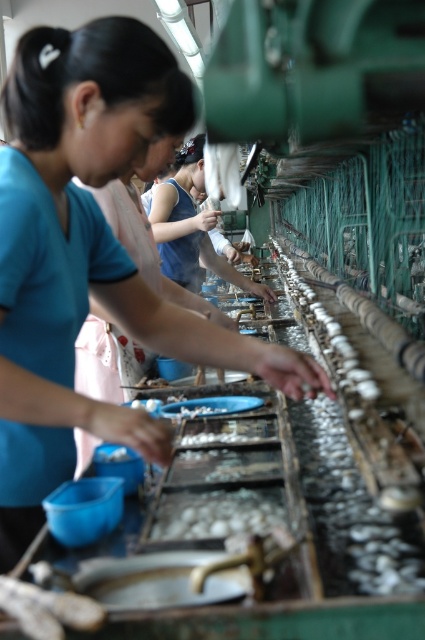
Question: Among these points, which one is nearest to the camera?

Choices:
 (A) (16, 384)
 (B) (193, 497)

Answer: (A)

Question: Does matte blue shirt at center lie behind white glossy oyster at center?

Choices:
 (A) yes
 (B) no

Answer: (B)

Question: Can you confirm if matte blue shirt at center is positioned to the right of white glossy oyster at center?

Choices:
 (A) no
 (B) yes

Answer: (A)

Question: Is matte blue shirt at center above white glossy oyster at center?

Choices:
 (A) no
 (B) yes

Answer: (B)

Question: Which of the following is the closest to the observer?

Choices:
 (A) white glossy oyster at center
 (B) matte blue shirt at center

Answer: (B)

Question: Which object appears closest to the camera in this image?

Choices:
 (A) matte blue shirt at center
 (B) white glossy oyster at center

Answer: (A)